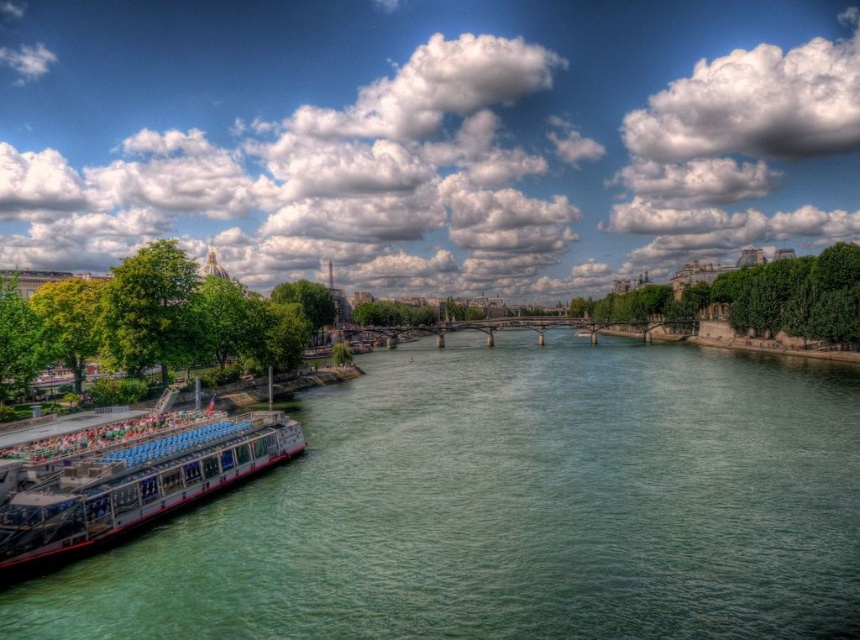
Question: Can you confirm if green smooth water at lower left is positioned to the left of white glossy boat at lower left?

Choices:
 (A) yes
 (B) no

Answer: (B)

Question: Which object appears closest to the camera in this image?

Choices:
 (A) green smooth water at lower left
 (B) white glossy boat at lower left

Answer: (A)

Question: Can you confirm if green smooth water at lower left is positioned above white glossy boat at lower left?

Choices:
 (A) yes
 (B) no

Answer: (A)

Question: Does green smooth water at lower left have a smaller size compared to white glossy boat at lower left?

Choices:
 (A) yes
 (B) no

Answer: (B)